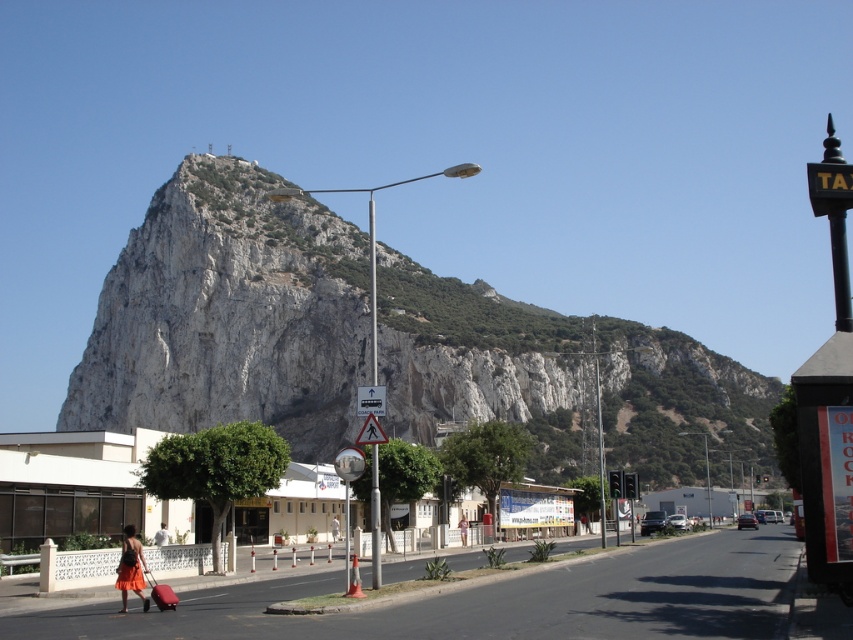
Question: Which point appears farthest from the camera in this image?

Choices:
 (A) (157, 218)
 (B) (134, 550)

Answer: (A)

Question: Which point is closer to the camera?

Choices:
 (A) orange fabric skirt at lower left
 (B) white rocky mountain at upper center
 (C) orange matte dress at lower left

Answer: (A)

Question: Can you confirm if white rocky mountain at upper center is wider than orange matte dress at lower left?

Choices:
 (A) yes
 (B) no

Answer: (A)

Question: In this image, where is orange fabric skirt at lower left located relative to orange matte dress at lower left?

Choices:
 (A) above
 (B) below

Answer: (B)

Question: Is white rocky mountain at upper center closer to camera compared to orange fabric skirt at lower left?

Choices:
 (A) no
 (B) yes

Answer: (A)

Question: Which object is farther from the camera taking this photo?

Choices:
 (A) orange matte dress at lower left
 (B) orange fabric skirt at lower left

Answer: (A)